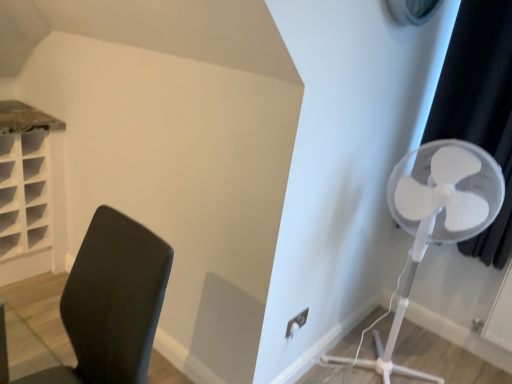
Question: Is black plastic chair at left bigger or smaller than white plastic fan at right?

Choices:
 (A) small
 (B) big

Answer: (A)

Question: From a real-world perspective, is black plastic chair at left positioned above or below white plastic fan at right?

Choices:
 (A) below
 (B) above

Answer: (A)

Question: Estimate the real-world distances between objects in this image. Which object is closer to the black plastic chair at left?

Choices:
 (A) black fabric curtain at right
 (B) white plastic fan at right

Answer: (B)

Question: Which is nearer to the black fabric curtain at right?

Choices:
 (A) black plastic chair at left
 (B) white plastic fan at right

Answer: (B)